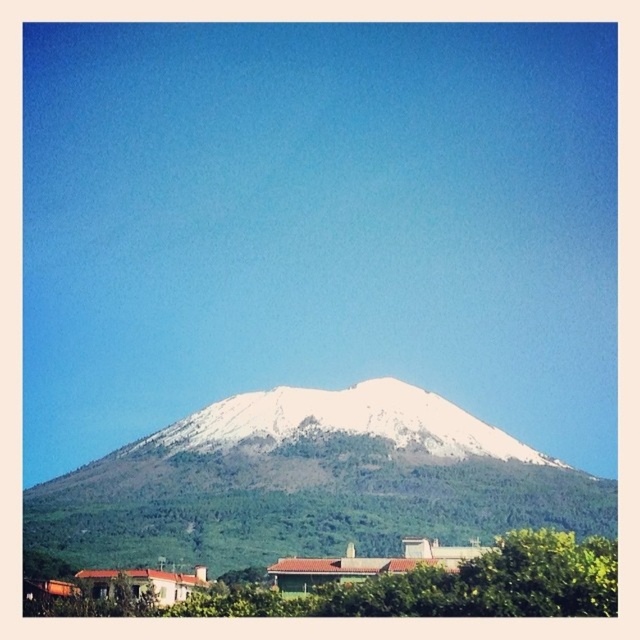
You are a hiker standing at the base of the mountain looking towards the snowy rock mountain at center. According to the map coordinates, there is a point marked at (308, 483). What does this point indicate?

The point marked at (308, 483) indicates the location of the snowy rock mountain at center.